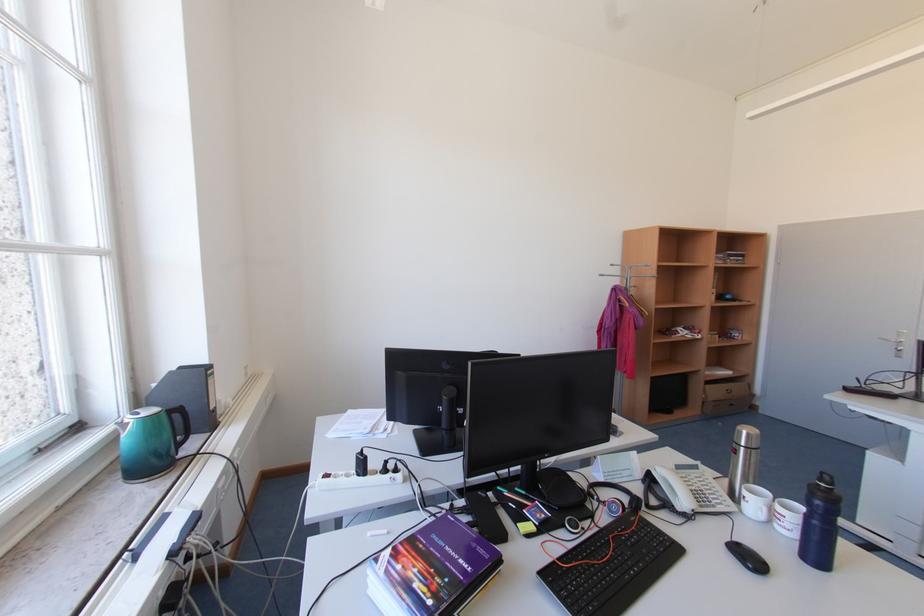
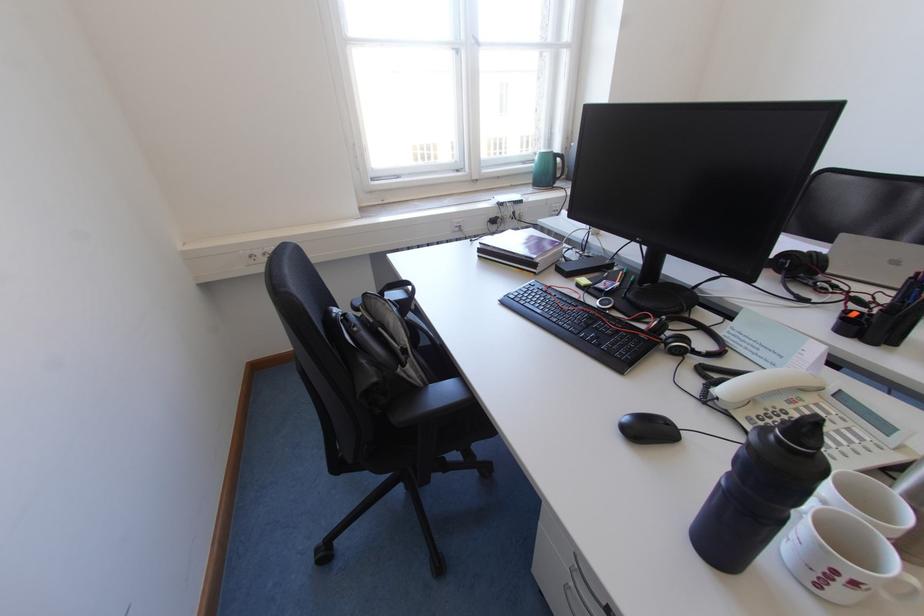
Where in the second image is the point corresponding to (x=675, y=507) from the first image?

(723, 384)